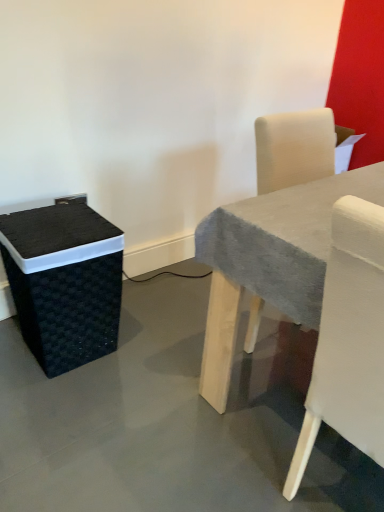
Question: In terms of height, does smooth gray table at center look taller or shorter compared to black woven basket at left?

Choices:
 (A) tall
 (B) short

Answer: (A)

Question: Considering their positions, is smooth gray table at center located in front of or behind black woven basket at left?

Choices:
 (A) front
 (B) behind

Answer: (A)

Question: Based on their relative distances, which object is nearer to the white fabric chair at right?

Choices:
 (A) smooth gray table at center
 (B) black woven basket at left

Answer: (A)

Question: Which is nearer to the smooth gray table at center?

Choices:
 (A) white fabric chair at right
 (B) black woven basket at left

Answer: (A)